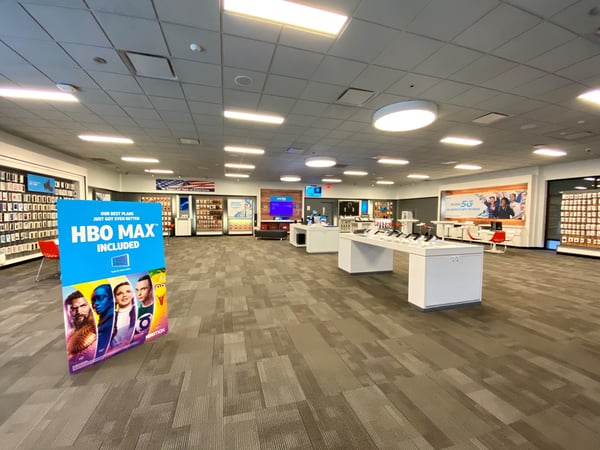
Image resolution: width=600 pixels, height=450 pixels. In order to click on table in this screenshot , I will do tap(460, 277), tap(322, 239).